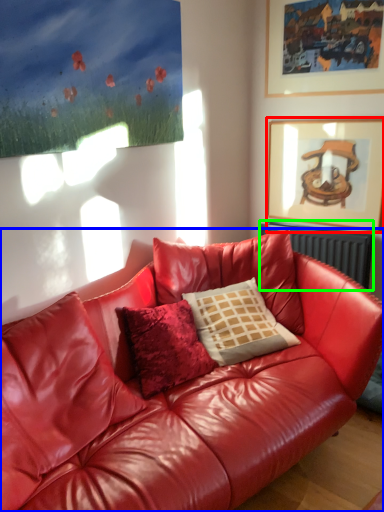
Question: Which is farther away from picture frame (highlighted by a red box)? studio couch (highlighted by a blue box) or radiator (highlighted by a green box)?

Choices:
 (A) studio couch
 (B) radiator

Answer: (A)